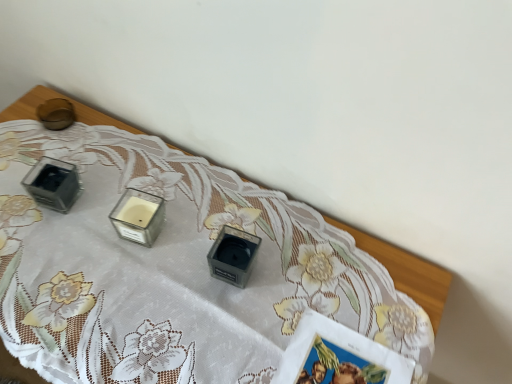
The height and width of the screenshot is (384, 512). What are the coordinates of `matte glass candle at upper left` in the screenshot? It's located at (406, 271).

This screenshot has width=512, height=384. What do you see at coordinates (406, 271) in the screenshot?
I see `matte glass candle at upper left` at bounding box center [406, 271].

Find the location of a particular element. The image size is (512, 384). clear glass candle at center is located at coordinates (138, 216).

In order to face clear glass candle at center, should I rotate leftwards or rightwards?

Rotate your view left by about 15.498°.

Image resolution: width=512 pixels, height=384 pixels. What do you see at coordinates (138, 216) in the screenshot?
I see `clear glass candle at center` at bounding box center [138, 216].

This screenshot has width=512, height=384. I want to click on matte glass candle at upper left, so click(406, 271).

From the picture: Based on their positions, is matte glass candle at upper left located to the left or right of clear glass candle at center?

Clearly, matte glass candle at upper left is on the right of clear glass candle at center in the image.

Between matte glass candle at upper left and clear glass candle at center, which one is positioned behind?

clear glass candle at center is further away from the camera.

Is point (2, 351) closer or farther from the camera than point (112, 213)?

Point (2, 351) is positioned farther from the camera compared to point (112, 213).

From the image's perspective, would you say matte glass candle at upper left is positioned over clear glass candle at center?

No.

From a real-world perspective, who is located lower, matte glass candle at upper left or clear glass candle at center?

In real-world perspective, matte glass candle at upper left is lower.

From the picture: Which object is thinner, matte glass candle at upper left or clear glass candle at center?

With smaller width is clear glass candle at center.

In terms of height, does matte glass candle at upper left look taller or shorter compared to clear glass candle at center?

In the image, matte glass candle at upper left appears to be taller than clear glass candle at center.

Considering the sizes of matte glass candle at upper left and clear glass candle at center in the image, is matte glass candle at upper left bigger or smaller than clear glass candle at center?

Considering their sizes, matte glass candle at upper left takes up more space than clear glass candle at center.

Consider the image. Can we say matte glass candle at upper left lies outside clear glass candle at center?

Absolutely, matte glass candle at upper left is external to clear glass candle at center.

Is matte glass candle at upper left with clear glass candle at center?

matte glass candle at upper left and clear glass candle at center are clearly separated.

Could you tell me if matte glass candle at upper left is turned towards clear glass candle at center?

No, matte glass candle at upper left does not turn towards clear glass candle at center.

Based on the photo, can you tell me how much matte glass candle at upper left and clear glass candle at center differ in facing direction?

15.8 degrees separate the facing orientations of matte glass candle at upper left and clear glass candle at center.

In order to click on table directly beneath the clear glass candle at center (from a real-world perspective) in this screenshot , I will do tap(406, 271).

Visually, is clear glass candle at center positioned to the left or to the right of matte glass candle at upper left?

clear glass candle at center is positioned on matte glass candle at upper left's left side.

Is the position of clear glass candle at center more distant than that of matte glass candle at upper left?

Yes, clear glass candle at center is behind matte glass candle at upper left.

Is point (142, 241) in front of point (91, 116)?

Yes, point (142, 241) is closer to viewer.

From the image's perspective, would you say clear glass candle at center is shown under matte glass candle at upper left?

Incorrect, from the image's perspective, clear glass candle at center is higher than matte glass candle at upper left.

From a real-world perspective, between clear glass candle at center and matte glass candle at upper left, who is vertically higher?

clear glass candle at center.

Considering the sizes of objects clear glass candle at center and matte glass candle at upper left in the image provided, who is thinner, clear glass candle at center or matte glass candle at upper left?

clear glass candle at center.

Can you confirm if clear glass candle at center is taller than matte glass candle at upper left?

Incorrect, the height of clear glass candle at center is not larger of that of matte glass candle at upper left.

Based on the photo, who is bigger, clear glass candle at center or matte glass candle at upper left?

With larger size is matte glass candle at upper left.

Is clear glass candle at center located outside matte glass candle at upper left?

Absolutely, clear glass candle at center is external to matte glass candle at upper left.

Are clear glass candle at center and matte glass candle at upper left located far from each other?

No, there isn't a large distance between clear glass candle at center and matte glass candle at upper left.

Does clear glass candle at center turn towards matte glass candle at upper left?

No, clear glass candle at center is not turned towards matte glass candle at upper left.

This screenshot has height=384, width=512. I want to click on table below the clear glass candle at center (from the image's perspective), so click(x=406, y=271).

Where is `table that is below the clear glass candle at center (from the image's perspective)`? This screenshot has height=384, width=512. table that is below the clear glass candle at center (from the image's perspective) is located at coordinates (406, 271).

Locate an element on the screen. Image resolution: width=512 pixels, height=384 pixels. candle holder behind the matte glass candle at upper left is located at coordinates [138, 216].